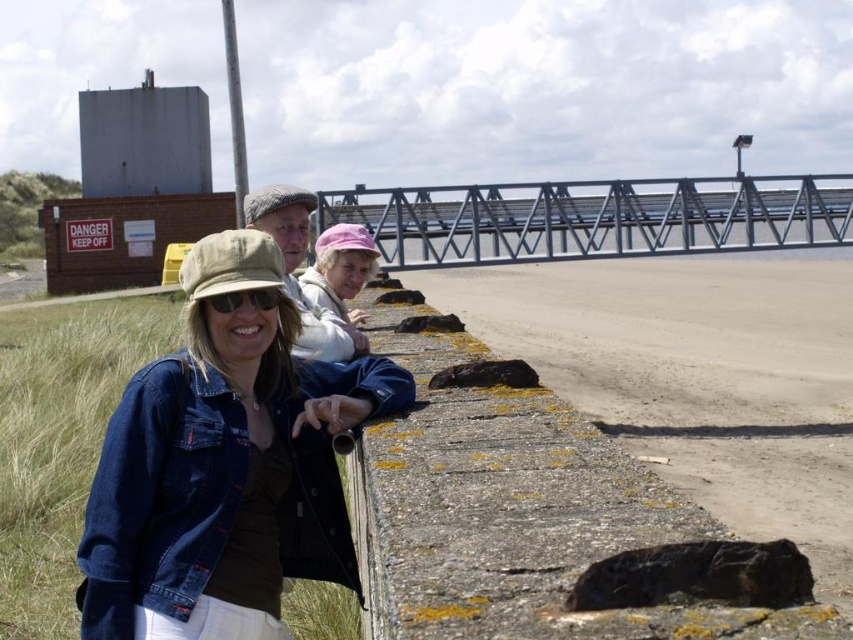
Question: Can you confirm if denim jacket at lower left is smaller than light brown woolen cap at center?

Choices:
 (A) no
 (B) yes

Answer: (A)

Question: Estimate the real-world distances between objects in this image. Which object is farther from the matte black goggles at center?

Choices:
 (A) pink fabric cap at center
 (B) denim jacket at lower left
 (C) light brown woolen cap at center

Answer: (A)

Question: Does denim jacket at lower left appear on the right side of light brown woolen cap at center?

Choices:
 (A) no
 (B) yes

Answer: (B)

Question: Which point appears farthest from the camera in this image?

Choices:
 (A) (492, 572)
 (B) (316, 275)
 (C) (367, 342)
 (D) (215, 259)

Answer: (B)

Question: Based on their relative distances, which object is farther from the yellowish concrete wall at lower left?

Choices:
 (A) metallic steel bridge at upper center
 (B) denim jacket at lower left

Answer: (B)

Question: Does metallic steel bridge at upper center appear on the left side of matte black goggles at center?

Choices:
 (A) no
 (B) yes

Answer: (A)